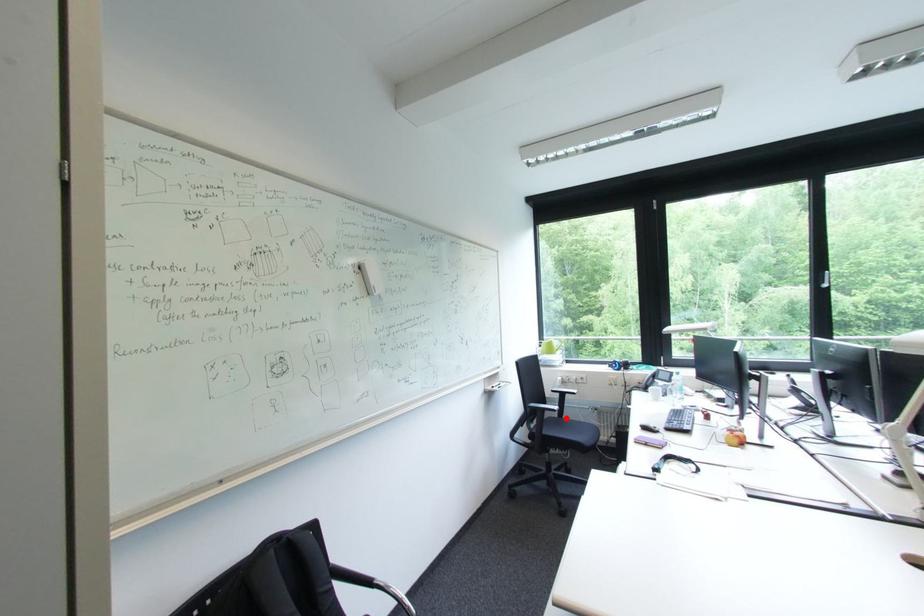
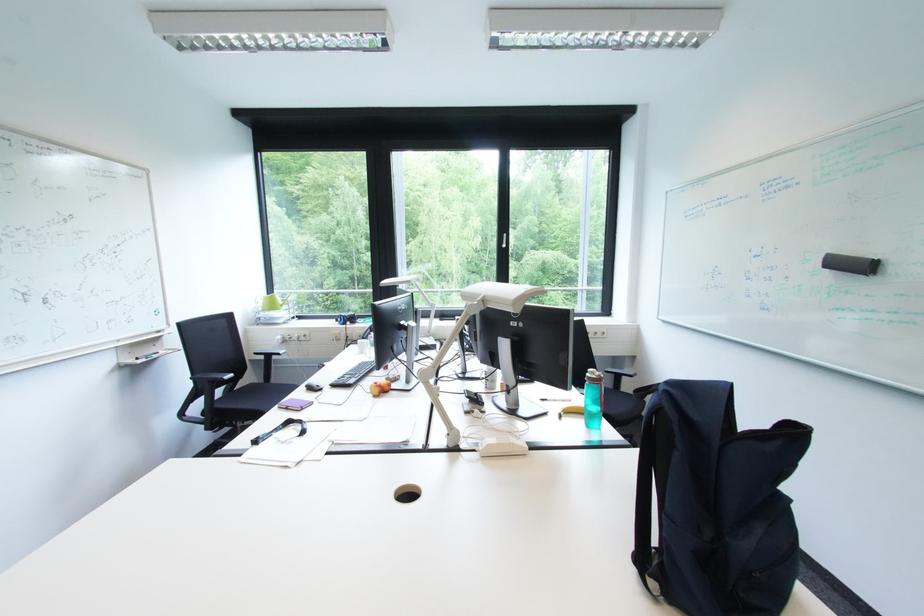
The point at the highlighted location is marked in the first image. Where is the corresponding point in the second image?

(272, 383)